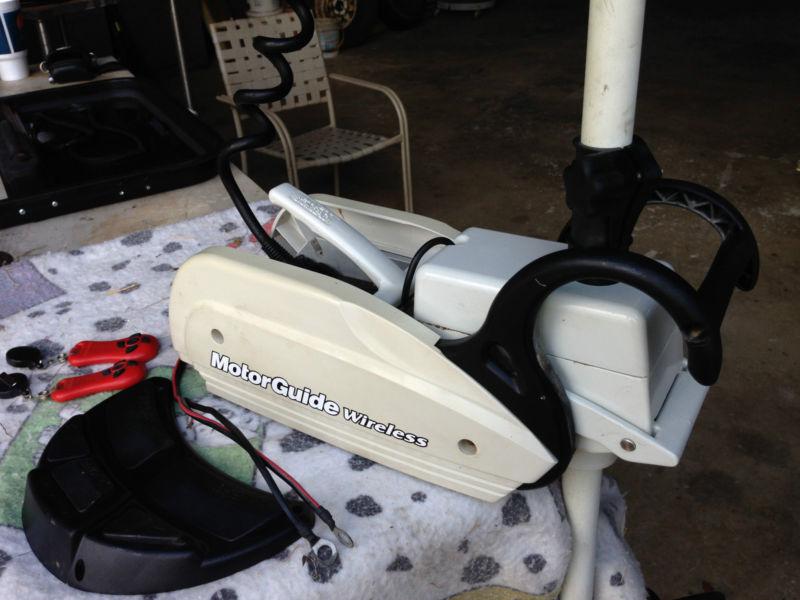
Image resolution: width=800 pixels, height=600 pixels. Find the location of `chair leg`. chair leg is located at coordinates (405, 155).